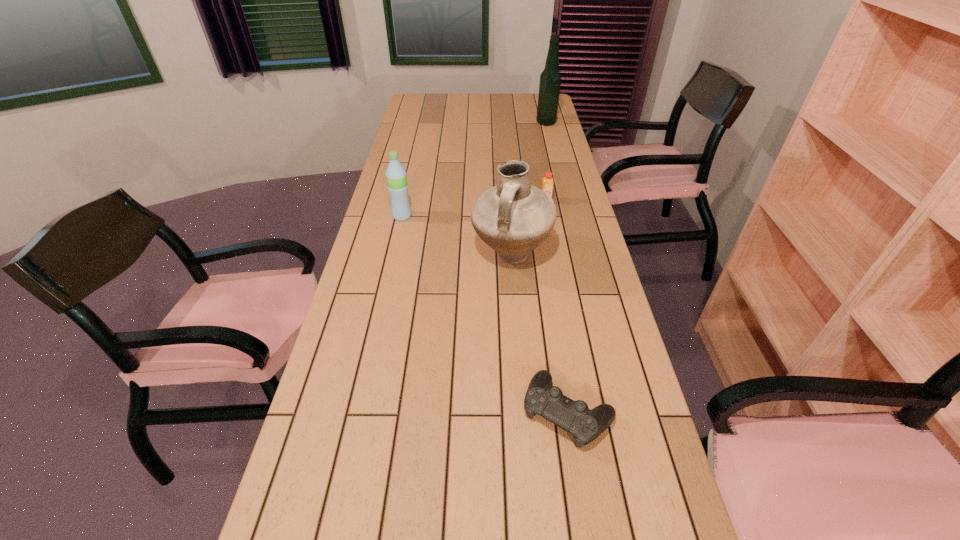
In the image, there is a desktop. Where is `free space at the far edge`? free space at the far edge is located at coordinates (518, 97).

The image size is (960, 540). Find the location of `free space at the left edge of the desktop`. free space at the left edge of the desktop is located at coordinates (413, 151).

Image resolution: width=960 pixels, height=540 pixels. What are the coordinates of `free space at the right edge of the desktop` in the screenshot? It's located at (605, 487).

The image size is (960, 540). I want to click on vacant space at the far left corner of the desktop, so click(x=420, y=93).

Identify the location of empty location between the tallest object and the third farthest object. The width and height of the screenshot is (960, 540). (474, 170).

This screenshot has height=540, width=960. Find the location of `vacant area that lies between the farthest object and the water bottle`. vacant area that lies between the farthest object and the water bottle is located at coordinates (474, 170).

Locate an element on the screen. vacant area that lies between the control and the second tallest object is located at coordinates (540, 334).

The height and width of the screenshot is (540, 960). What are the coordinates of `free space between the nearest object and the second shortest object` in the screenshot? It's located at (557, 306).

Locate an element on the screen. This screenshot has height=540, width=960. empty space between the second farthest object and the control is located at coordinates (557, 306).

Locate an element on the screen. This screenshot has width=960, height=540. vacant space that's between the fourth nearest object and the farthest object is located at coordinates (546, 162).